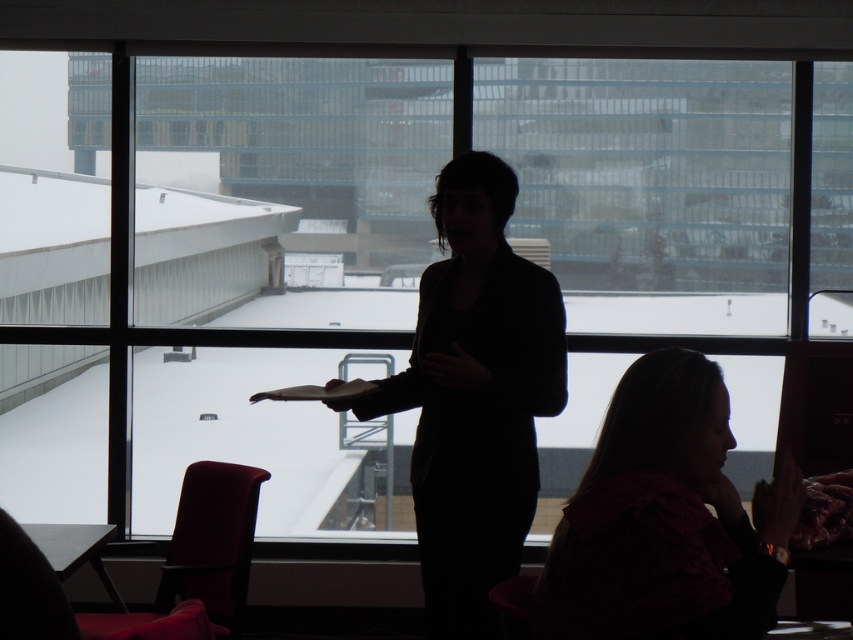
Does black matte jacket at center have a larger size compared to matte pink blouse at lower right?

Indeed, black matte jacket at center has a larger size compared to matte pink blouse at lower right.

Who is positioned more to the right, black matte jacket at center or matte pink blouse at lower right?

matte pink blouse at lower right

The height and width of the screenshot is (640, 853). What are the coordinates of `black matte jacket at center` in the screenshot? It's located at (474, 396).